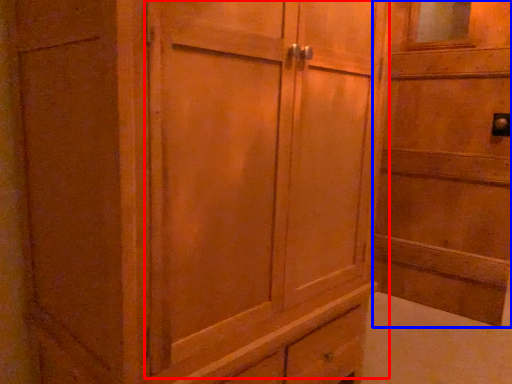
Question: Among these objects, which one is nearest to the camera, barn door (highlighted by a red box) or elevator (highlighted by a blue box)?

Choices:
 (A) barn door
 (B) elevator

Answer: (A)